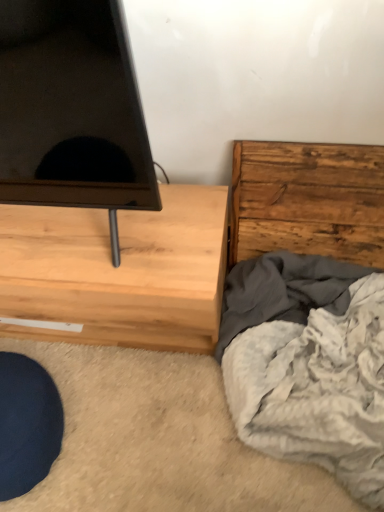
Image resolution: width=384 pixels, height=512 pixels. Identify the location of free point above light wood chest of drawers at left, acting as the 1th chest of drawers starting from the left (from a real-world perspective). (92, 239).